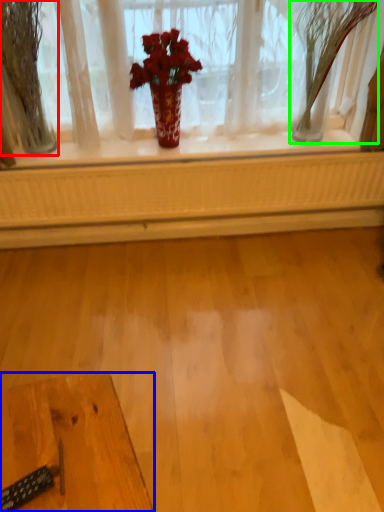
Question: Which is farther away from tree (highlighted by a red box)? table (highlighted by a blue box) or tree (highlighted by a green box)?

Choices:
 (A) table
 (B) tree

Answer: (A)